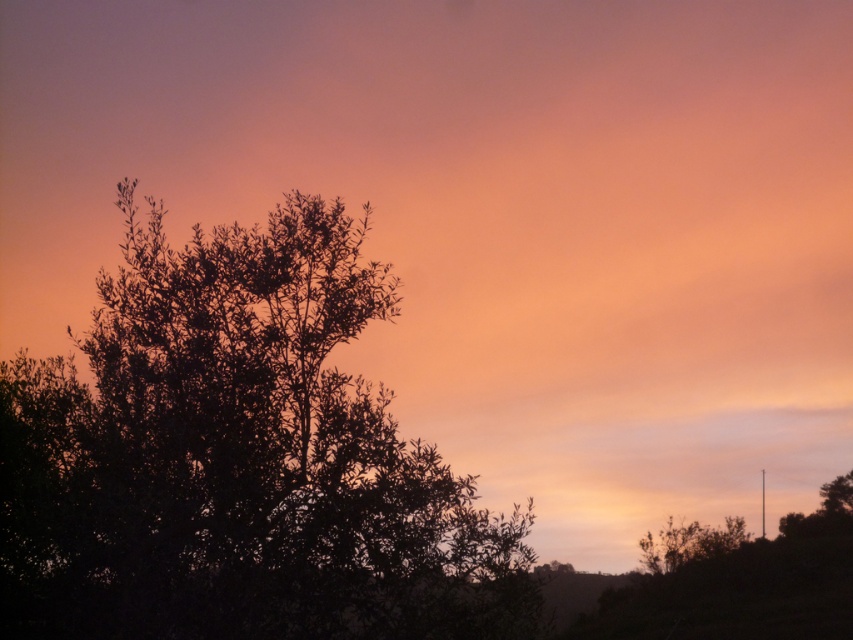
Consider the image. You are standing in the middle of the scene and want to walk towards the green leafy bush at lower right. Which direction should you face to ensure the dark green leafy tree at left is behind you?

You should face towards the right direction. Since the dark green leafy tree at left is to the left of the green leafy bush at lower right, facing right towards the bush will place the tree behind you.

Based on the scene description, where is the dark green leafy tree at left located in terms of its 2D coordinates?

The dark green leafy tree at left is located at the 2D coordinates of point [239,458].